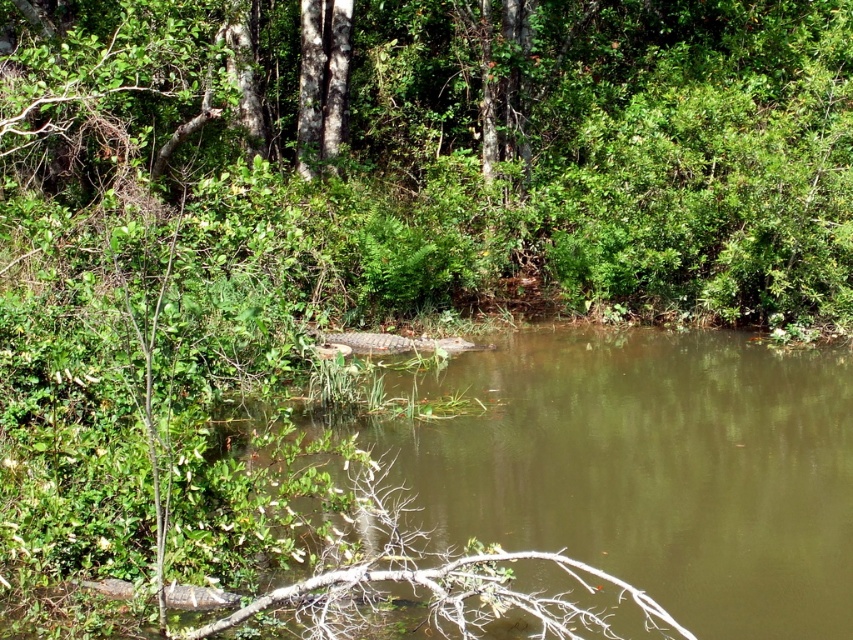
Question: Which object is farther from the camera taking this photo?

Choices:
 (A) green leafy tree at center
 (B) brown muddy water at center

Answer: (A)

Question: Can you confirm if green leafy tree at center is smaller than brown muddy water at center?

Choices:
 (A) no
 (B) yes

Answer: (A)

Question: Where is green leafy tree at center located in relation to brown muddy water at center in the image?

Choices:
 (A) above
 (B) below

Answer: (A)

Question: Which point appears closest to the camera in this image?

Choices:
 (A) (804, 467)
 (B) (384, 182)

Answer: (A)

Question: Does green leafy tree at center have a larger size compared to brown muddy water at center?

Choices:
 (A) yes
 (B) no

Answer: (A)